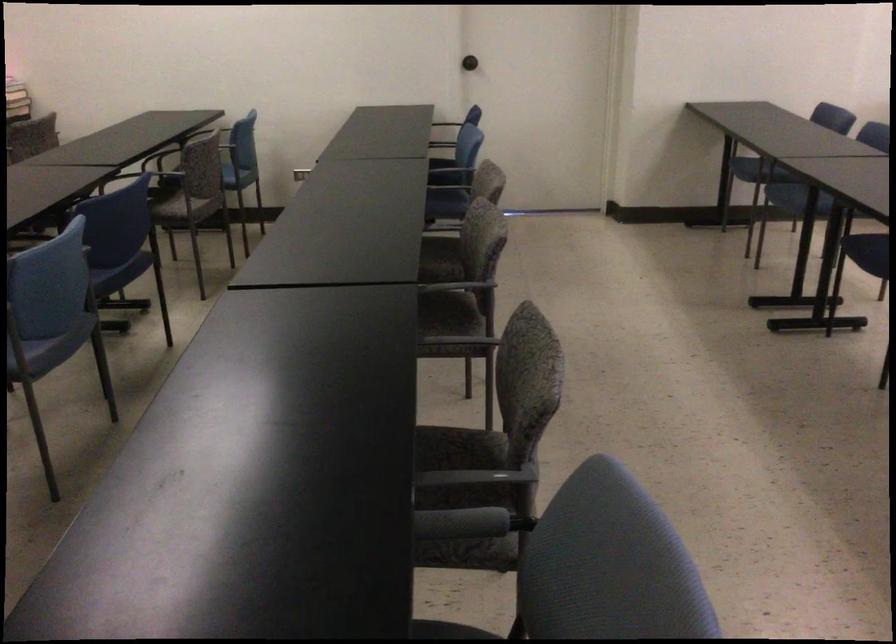
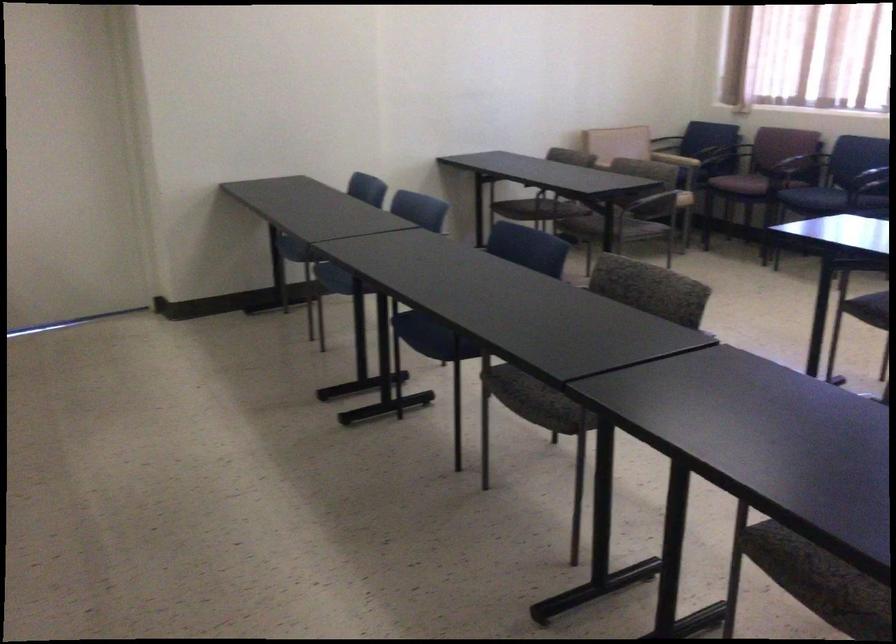
Question: The images are taken continuously from a first-person perspective. In which direction is your viewpoint rotating?

Choices:
 (A) Left
 (B) Right
 (C) Up
 (D) Down

Answer: (B)